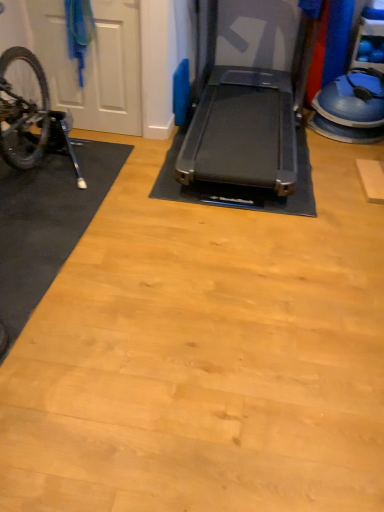
Locate an element on the screen. free space on the front side of white matte door at left is located at coordinates (98, 148).